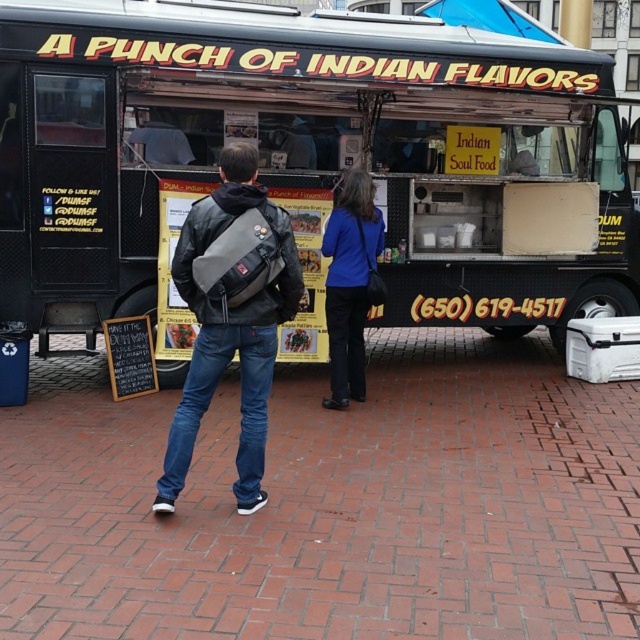
You are a customer standing in front of the black matte food truck at center and the blue fabric canopy at upper center. Which object is taller?

The blue fabric canopy at upper center is taller than the black matte food truck at center.

You are a customer waiting in line at the food truck. You notice a leather jacket at center and a matte plastic cupcake at center. If you want to grab the cupcake without moving your position, can you reach it?

The leather jacket at center is 2.50 meters from matte plastic cupcake at center. Since the distance is 2.50 meters, you cannot reach the matte plastic cupcake at center from your current position without moving.

You are a customer waiting in line at the black matte food truck at center. You look up and see the blue fabric canopy at upper center. Which object is higher in the image?

The blue fabric canopy at upper center is higher than the black matte food truck at center because it is positioned above it.